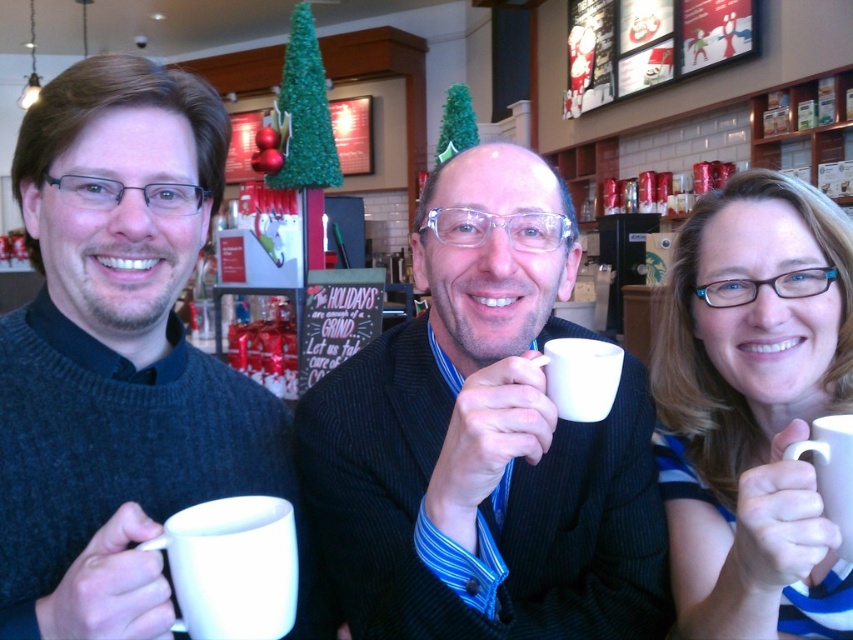
Consider the image. You are a barista in a cafe and need to place a new order for the person holding the white matte mug at left. Where should you place the new mug to match their current mug?

Place the new mug at the coordinates point (115, 355) to match the position of the white matte mug at left.

You are a barista trying to deliver a drink to the customer holding the white matte mug at left and the white matte mug at lower left. Which mug should you place the drink in front of to ensure it is closest to the customer?

The white matte mug at left is closer to the viewer than the white matte mug at lower left, so you should place the drink in front of the white matte mug at left to ensure it is closest to the customer.

You are a barista trying to place the white matte mug at left and the blue striped shirt at right on a shelf. The shelf has a width limit of 15 cm. Can both items fit side by side?

The white matte mug at left is larger in width than the blue striped shirt at right. However, since the shelf has a width limit of 15 cm, we need to know the exact widths of both items to determine if they can fit together. Unfortunately, the provided information does not specify the exact measurements of either item, only that the mug is wider than the shirt. Without knowing the specific widths, it is impossible to confirm if their combined width stays within the 15 cm limit.